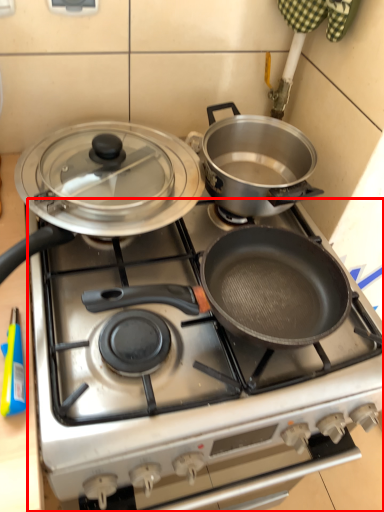
Question: Observing the image, what is the correct spatial positioning of gas stove (annotated by the red box) in reference to kitchen appliance?

Choices:
 (A) right
 (B) left

Answer: (A)